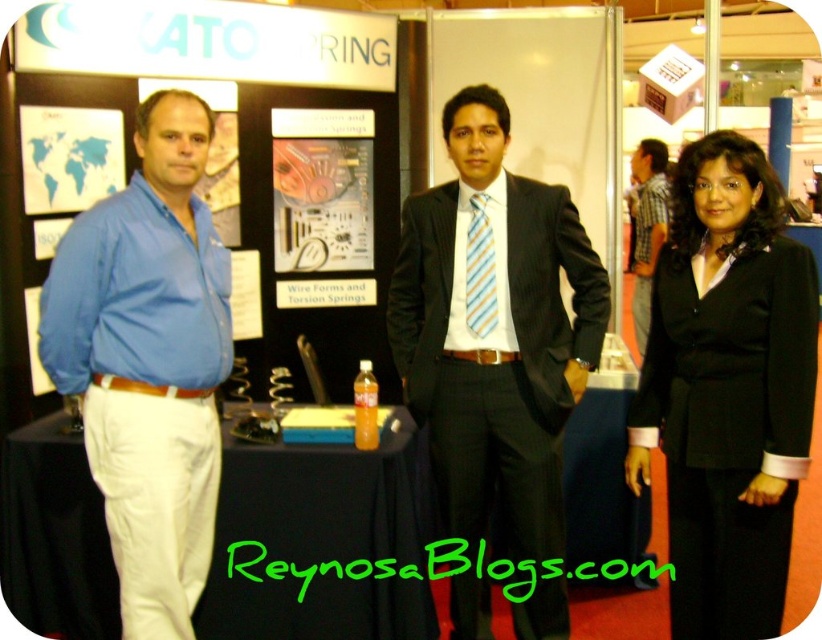
Does blue map at upper left appear on the left side of striped cotton shirt at right?

Correct, you'll find blue map at upper left to the left of striped cotton shirt at right.

Where is `blue map at upper left`? blue map at upper left is located at coordinates (68, 157).

Is point (67, 125) in front of point (654, 243)?

Yes.

Identify the location of blue map at upper left. (68, 157).

Does blue cotton shirt at left have a greater width compared to blue map at upper left?

Correct, the width of blue cotton shirt at left exceeds that of blue map at upper left.

Is point (105, 497) positioned before point (47, 116)?

Yes, point (105, 497) is in front of point (47, 116).

Does point (123, 262) come closer to viewer compared to point (72, 161)?

Yes, point (123, 262) is closer to viewer.

Identify the location of blue cotton shirt at left. (148, 362).

The height and width of the screenshot is (640, 822). What do you see at coordinates (497, 346) in the screenshot? I see `matte black suit at center` at bounding box center [497, 346].

Is point (430, 336) in front of point (485, 285)?

No, (430, 336) is further to viewer.

Between point (515, 276) and point (473, 332), which one is positioned behind?

Point (473, 332)

Find the location of `matte black suit at center`. matte black suit at center is located at coordinates (497, 346).